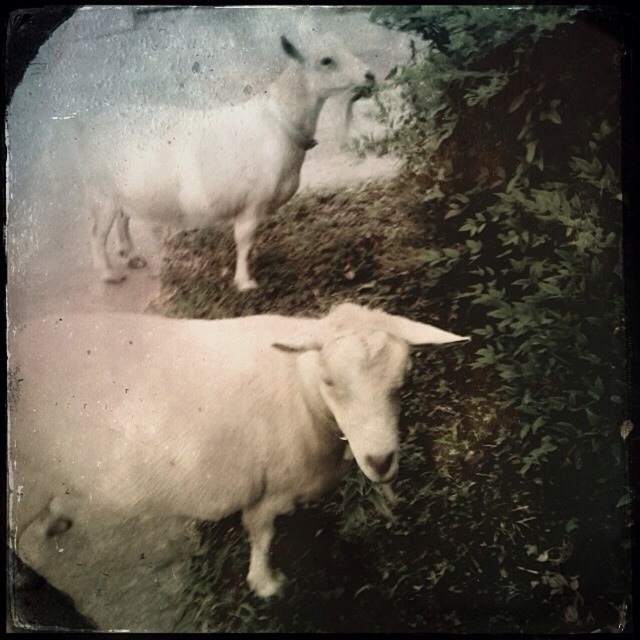
Does green leafy grass at upper center appear on the right side of white woolen goat at upper center?

Correct, you'll find green leafy grass at upper center to the right of white woolen goat at upper center.

Can you confirm if green leafy grass at upper center is positioned above white woolen goat at upper center?

Incorrect, green leafy grass at upper center is not positioned above white woolen goat at upper center.

Which is in front, point (282, 625) or point (109, 220)?

Point (282, 625) is in front.

Find the location of a particular element. The width and height of the screenshot is (640, 640). green leafy grass at upper center is located at coordinates (468, 342).

Can you confirm if white woolen sheep at lower left is shorter than white woolen goat at upper center?

No, white woolen sheep at lower left is not shorter than white woolen goat at upper center.

Does white woolen sheep at lower left lie in front of white woolen goat at upper center?

Yes, it is.

This screenshot has width=640, height=640. What do you see at coordinates (205, 416) in the screenshot? I see `white woolen sheep at lower left` at bounding box center [205, 416].

The image size is (640, 640). Identify the location of white woolen sheep at lower left. (205, 416).

Which is below, green leafy grass at upper center or white woolen sheep at lower left?

Positioned lower is white woolen sheep at lower left.

Is the position of green leafy grass at upper center more distant than that of white woolen sheep at lower left?

No, green leafy grass at upper center is closer to the viewer.

Where is `green leafy grass at upper center`? green leafy grass at upper center is located at coordinates (468, 342).